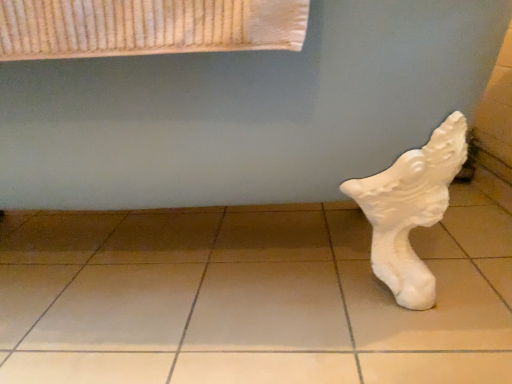
Question: In terms of height, does white matte sculpture at lower right look taller or shorter compared to white matte tile at lower right?

Choices:
 (A) tall
 (B) short

Answer: (A)

Question: In terms of size, does white matte sculpture at lower right appear bigger or smaller than white matte tile at lower right?

Choices:
 (A) small
 (B) big

Answer: (B)

Question: From the image's perspective, is white matte sculpture at lower right located above or below white matte tile at lower right?

Choices:
 (A) below
 (B) above

Answer: (B)

Question: Considering the positions of point (316, 286) and point (460, 21), is point (316, 286) closer or farther from the camera than point (460, 21)?

Choices:
 (A) farther
 (B) closer

Answer: (A)

Question: Is white matte tile at lower right bigger or smaller than white matte sculpture at lower right?

Choices:
 (A) small
 (B) big

Answer: (A)

Question: Is white matte tile at lower right inside or outside of white matte sculpture at lower right?

Choices:
 (A) inside
 (B) outside

Answer: (B)

Question: Is white matte tile at lower right taller or shorter than white matte sculpture at lower right?

Choices:
 (A) short
 (B) tall

Answer: (A)